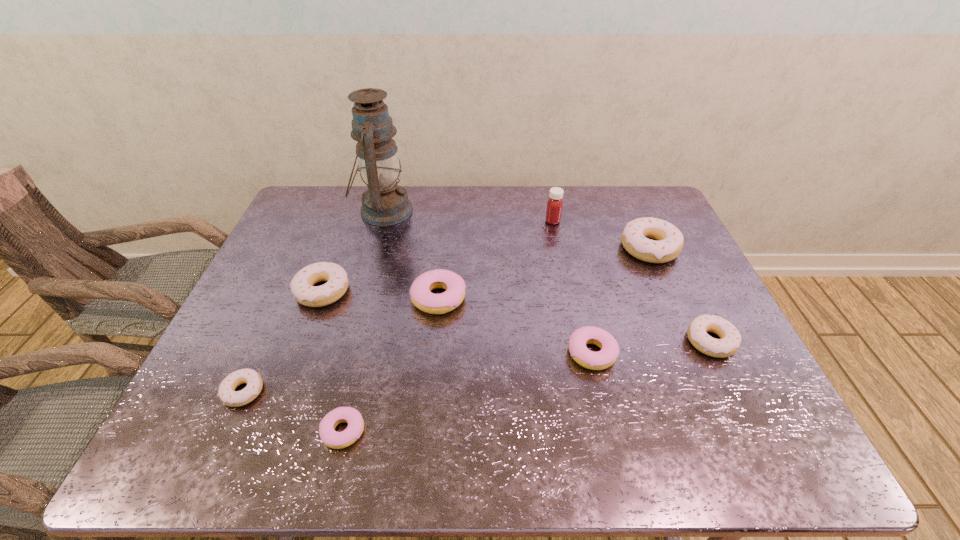
Find the location of a particular element. The width and height of the screenshot is (960, 540). vacant space situated 0.270m on the back of the second smallest white doughnut is located at coordinates (669, 255).

You are a GUI agent. You are given a task and a screenshot of the screen. Output one action in this format:
    pyautogui.click(x=<x>, y=<y>)
    Task: Click on the vacant space situated on the right of the rightmost pink doughnut
    Image resolution: width=960 pixels, height=540 pixels.
    Given the screenshot: What is the action you would take?
    pyautogui.click(x=669, y=353)

This screenshot has width=960, height=540. Find the location of `free point located 0.070m on the front of the nearest white doughnut`. free point located 0.070m on the front of the nearest white doughnut is located at coordinates (222, 440).

Where is `vacant space located 0.080m on the right of the nearest doughnut`? The height and width of the screenshot is (540, 960). vacant space located 0.080m on the right of the nearest doughnut is located at coordinates (403, 431).

This screenshot has height=540, width=960. In order to click on oil lamp present at the far edge in this screenshot , I will do `click(384, 203)`.

The image size is (960, 540). In order to click on medicine present at the far edge in this screenshot , I will do `click(555, 203)`.

Locate an element on the screen. This screenshot has height=540, width=960. object that is positioned at the near edge is located at coordinates (331, 438).

Locate an element on the screen. free space at the far edge is located at coordinates (493, 213).

I want to click on vacant space at the near edge of the desktop, so click(313, 436).

Locate an element on the screen. This screenshot has height=540, width=960. free space at the left edge of the desktop is located at coordinates (232, 330).